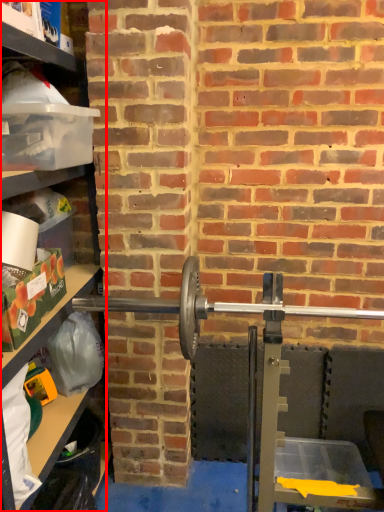
Question: From the image's perspective, considering the relative positions of shelf (annotated by the red box) and barbell in the image provided, where is shelf (annotated by the red box) located with respect to the staircase?

Choices:
 (A) above
 (B) below

Answer: (B)